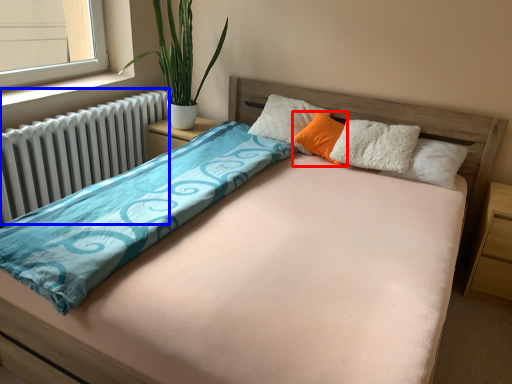
Question: Which of the following is the closest to the observer, pillow (highlighted by a red box) or radiator (highlighted by a blue box)?

Choices:
 (A) pillow
 (B) radiator

Answer: (B)